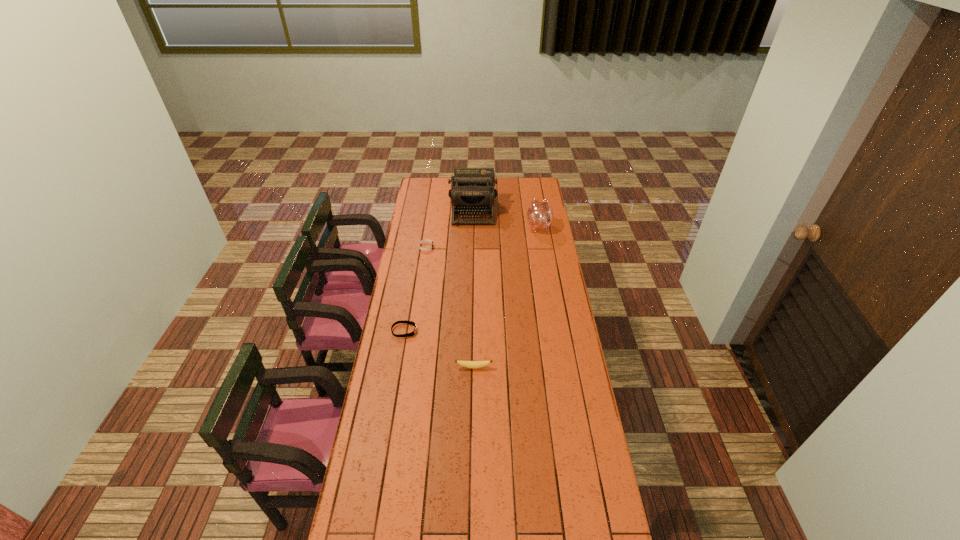
At what (x,y) coordinates should I click in order to perform the action: click on free region at the far left corner of the desktop. Please return your answer as a coordinate pair (x, y). The height and width of the screenshot is (540, 960). Looking at the image, I should click on click(x=424, y=192).

The image size is (960, 540). In the image, there is a desktop. Identify the location of vacant space at the far right corner. (524, 179).

Identify the location of empty space between the third nearest object and the tallest object. This screenshot has width=960, height=540. (449, 228).

I want to click on free area in between the third tallest object and the typewriter, so click(473, 288).

Find the location of a particular element. unoccupied area between the nearer wristband and the third nearest object is located at coordinates (415, 289).

The height and width of the screenshot is (540, 960). What are the coordinates of `vacant point located between the nearest object and the shorter wristband` in the screenshot? It's located at (439, 349).

Locate an element on the screen. Image resolution: width=960 pixels, height=540 pixels. free spot between the typewriter and the shortest object is located at coordinates (439, 271).

This screenshot has height=540, width=960. In order to click on vacant area between the fourth farthest object and the taller wristband in this screenshot , I will do `click(415, 289)`.

At what (x,y) coordinates should I click in order to perform the action: click on free space between the tallest object and the nearest object. Please return your answer as a coordinate pair (x, y). This screenshot has width=960, height=540. Looking at the image, I should click on (473, 288).

Where is `object that can be found as the closest to the piggy bank`? The height and width of the screenshot is (540, 960). object that can be found as the closest to the piggy bank is located at coordinates (472, 192).